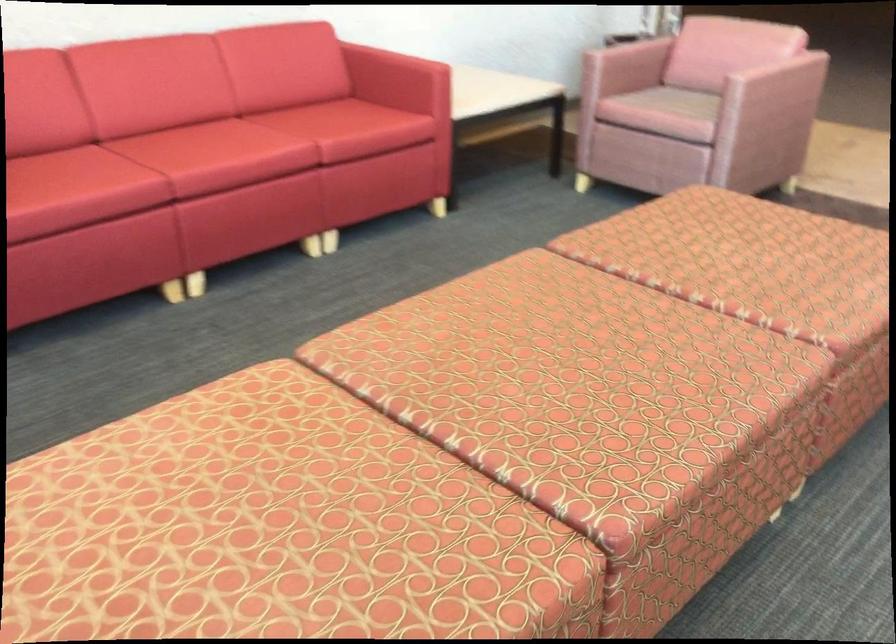
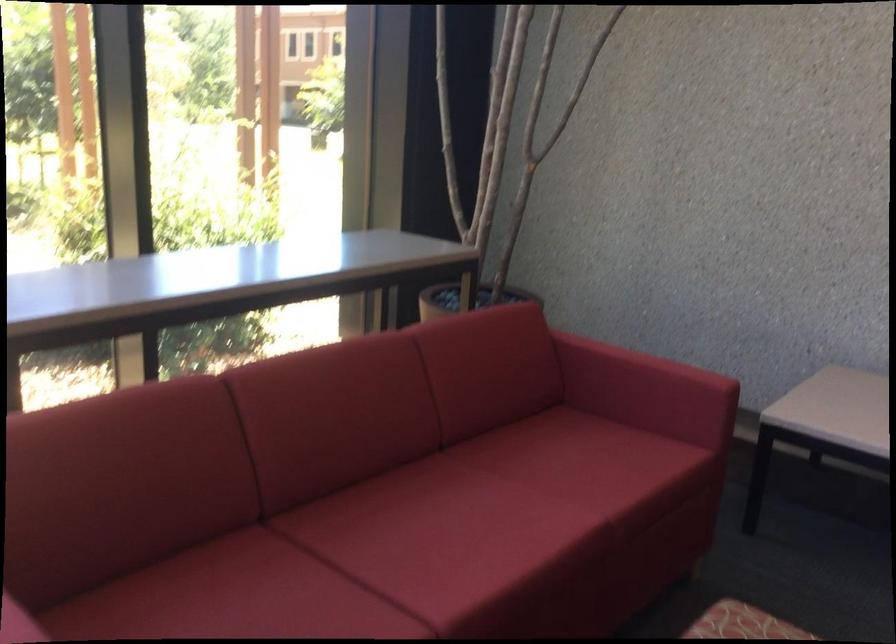
Question: Based on the continuous images, in which direction is the camera rotating? Reply with the corresponding letter.

Choices:
 (A) Left
 (B) Right
 (C) Up
 (D) Down

Answer: (A)